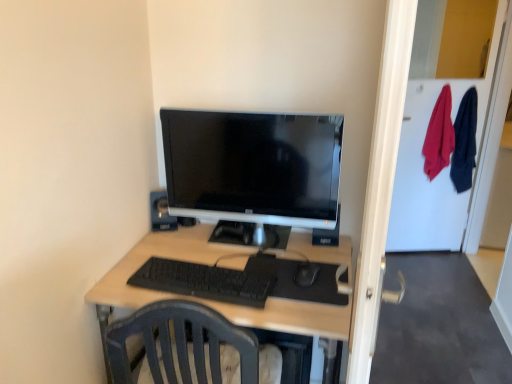
Locate an element on the screen. This screenshot has height=384, width=512. black matte keyboard at center is located at coordinates (204, 281).

I want to click on satin black monitor at center, so click(252, 167).

Would you say transparent glass door at right is inside or outside black matte keyboard at center?

transparent glass door at right cannot be found inside black matte keyboard at center.

Is transparent glass door at right looking in the opposite direction of black matte keyboard at center?

No, transparent glass door at right is not facing away from black matte keyboard at center.

Locate an element on the screen. computer keyboard that is under the transparent glass door at right (from a real-world perspective) is located at coordinates (204, 281).

This screenshot has height=384, width=512. Find the location of `desk located below the satin black monitor at center (from the image's perspective)`. desk located below the satin black monitor at center (from the image's perspective) is located at coordinates (212, 300).

Which is further, (226, 137) or (263, 315)?

The point (226, 137) is more distant.

In the scene shown: Which is more to the right, satin black monitor at center or light wood desk at center?

satin black monitor at center is more to the right.

Which object is thinner, satin black monitor at center or light wood desk at center?

satin black monitor at center is thinner.

Considering the positions of objects satin black monitor at center and black matte keyboard at center in the image provided, who is in front, satin black monitor at center or black matte keyboard at center?

Positioned in front is black matte keyboard at center.

Is satin black monitor at center aimed at black matte keyboard at center?

Yes, satin black monitor at center faces towards black matte keyboard at center.

Considering the relative sizes of satin black monitor at center and black matte keyboard at center in the image provided, is satin black monitor at center wider than black matte keyboard at center?

No, satin black monitor at center is not wider than black matte keyboard at center.

Is light wood desk at center turned away from satin black monitor at center?

No, light wood desk at center is not facing away from satin black monitor at center.

From a real-world perspective, is light wood desk at center under satin black monitor at center?

Yes, from a real-world perspective, light wood desk at center is below satin black monitor at center.

From a real-world perspective, relative to satin black monitor at center, is black matte keyboard at center vertically above or below?

From a real-world perspective, black matte keyboard at center is physically below satin black monitor at center.

At what (x,y) coordinates should I click in order to perform the action: click on computer monitor on the right of black matte keyboard at center. Please return your answer as a coordinate pair (x, y). Looking at the image, I should click on (252, 167).

Considering the positions of points (224, 282) and (255, 173), is point (224, 282) closer to camera compared to point (255, 173)?

Yes, it is in front of point (255, 173).

Considering the sizes of black matte keyboard at center and satin black monitor at center in the image, is black matte keyboard at center taller or shorter than satin black monitor at center?

In the image, black matte keyboard at center appears to be shorter than satin black monitor at center.

Is black plastic speaker at upper center aimed at transparent glass door at right?

No, black plastic speaker at upper center is not facing towards transparent glass door at right.

Which of these two, black plastic speaker at upper center or transparent glass door at right, stands taller?

With more height is transparent glass door at right.

Is black plastic speaker at upper center beside transparent glass door at right?

black plastic speaker at upper center is not next to transparent glass door at right, and they're not touching.

Considering the sizes of black plastic mouse at center and light wood desk at center in the image, is black plastic mouse at center wider or thinner than light wood desk at center?

Clearly, black plastic mouse at center has less width compared to light wood desk at center.

Considering the relative sizes of black plastic mouse at center and light wood desk at center in the image provided, is black plastic mouse at center bigger than light wood desk at center?

No, black plastic mouse at center is not bigger than light wood desk at center.

Are black plastic mouse at center and light wood desk at center making contact?

No, black plastic mouse at center is not in contact with light wood desk at center.

The image size is (512, 384). I want to click on computer keyboard located underneath the transparent glass door at right (from a real-world perspective), so click(204, 281).

Identify the location of desk on the left of satin black monitor at center. (212, 300).

Looking at the image, which one is located closer to satin black monitor at center, black plastic speaker at upper center or black matte keyboard at center?

black plastic speaker at upper center is positioned closer to the anchor satin black monitor at center.

Estimate the real-world distances between objects in this image. Which object is further from black plastic mouse at center, black plastic speaker at upper center or light wood desk at center?

black plastic speaker at upper center is positioned further to the anchor black plastic mouse at center.

Looking at the image, which one is located closer to black matte keyboard at center, satin black monitor at center or black plastic speaker at upper center?

Among the two, satin black monitor at center is located nearer to black matte keyboard at center.

When comparing their distances from black matte keyboard at center, does black plastic mouse at center or light wood desk at center seem further?

black plastic mouse at center is further to black matte keyboard at center.

Which object lies nearer to the anchor point black plastic speaker at upper center, transparent glass door at right or black plastic mouse at center?

black plastic mouse at center.

Which object lies nearer to the anchor point black plastic speaker at upper center, light wood desk at center or transparent glass door at right?

light wood desk at center is positioned closer to the anchor black plastic speaker at upper center.

When comparing their distances from light wood desk at center, does black plastic speaker at upper center or black matte keyboard at center seem further?

Among the two, black plastic speaker at upper center is located further to light wood desk at center.

Based on their spatial positions, is satin black monitor at center or black plastic mouse at center closer to transparent glass door at right?

The object closer to transparent glass door at right is satin black monitor at center.

The width and height of the screenshot is (512, 384). I want to click on computer monitor located between black plastic speaker at upper center and black plastic mouse at center in the left-right direction, so click(x=252, y=167).

Locate an element on the screen. The image size is (512, 384). speaker between satin black monitor at center and light wood desk at center vertically is located at coordinates (161, 212).

Identify the location of desk between black matte keyboard at center and transparent glass door at right. This screenshot has width=512, height=384. (212, 300).

Where is `mouse between satin black monitor at center and black matte keyboard at center vertically`? The height and width of the screenshot is (384, 512). mouse between satin black monitor at center and black matte keyboard at center vertically is located at coordinates (306, 274).